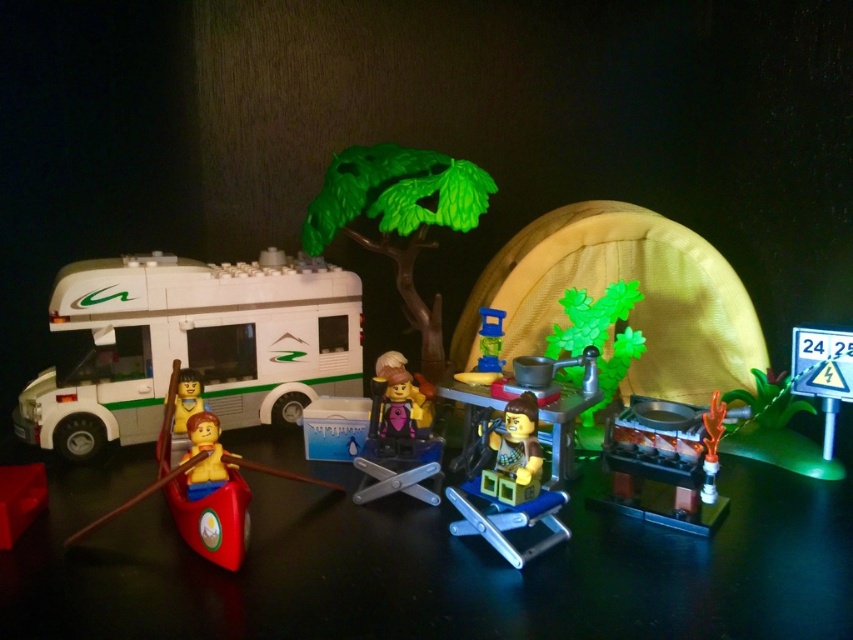
You are a LEGO figure standing next to the white plastic recreational vehicle at left and the translucent blue plastic cup at center. Which object would you need to move if you want to place the cup closer to the van?

You would need to move the translucent blue plastic cup at center because the white plastic recreational vehicle at left is bigger and likely cannot be moved easily.

Based on the provided scene, where is the green plastic minifigure at center located in terms of coordinates?

The green plastic minifigure at center is located at coordinates point (511, 486).